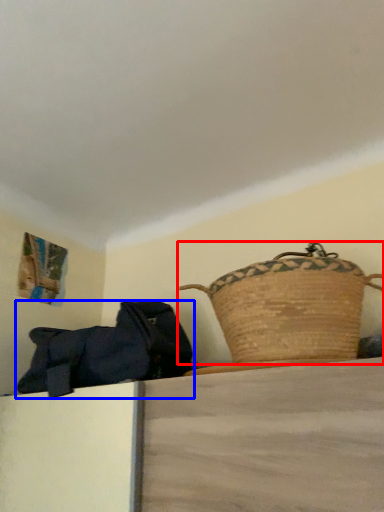
Question: Among these objects, which one is farthest to the camera, picnic basket (highlighted by a red box) or handbag (highlighted by a blue box)?

Choices:
 (A) picnic basket
 (B) handbag

Answer: (B)